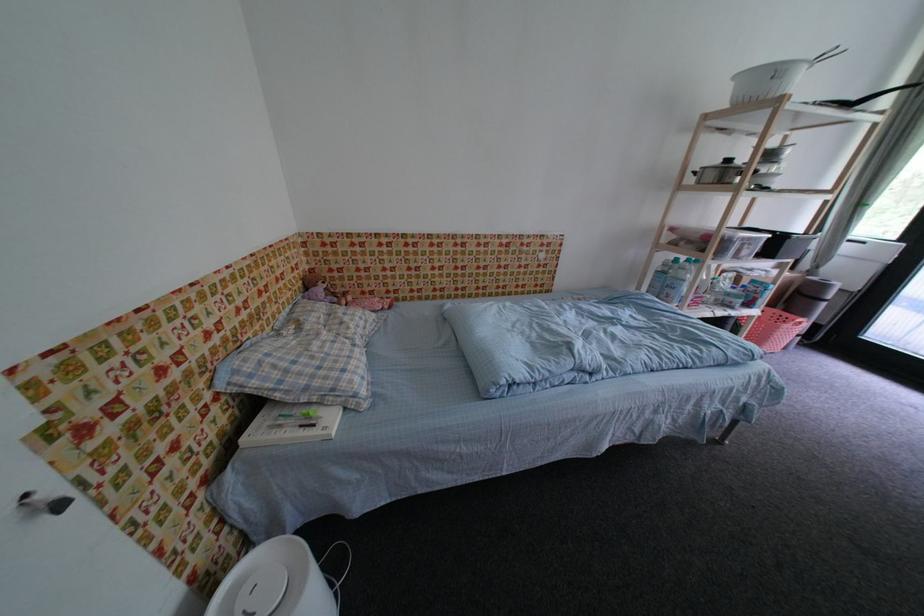
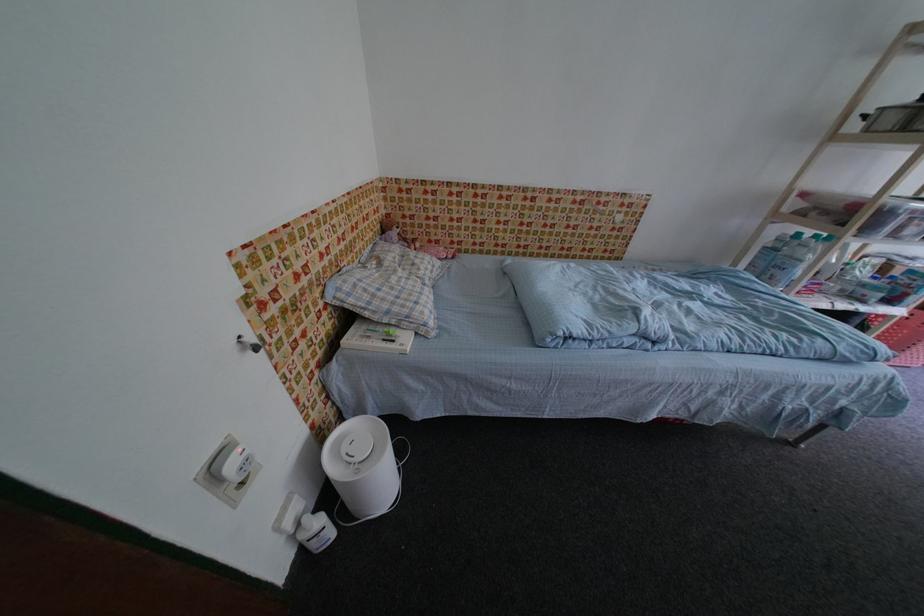
Locate, in the second image, the point that corresponds to pixel 283 310 in the first image.

(370, 246)